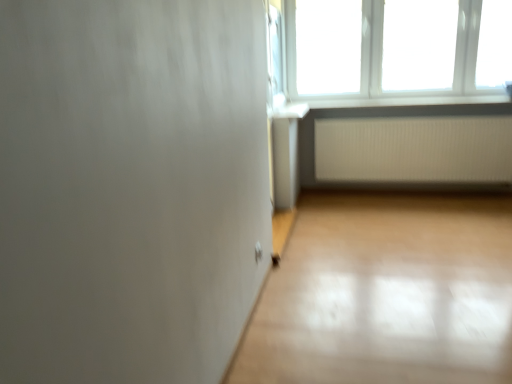
Question: Looking at their shapes, would you say white plastic window at upper right is wider or thinner than white plastic window sill at upper right?

Choices:
 (A) thin
 (B) wide

Answer: (A)

Question: From a real-world perspective, is white plastic window at upper right physically located above or below white plastic window sill at upper right?

Choices:
 (A) below
 (B) above

Answer: (B)

Question: Based on their relative distances, which object is nearer to the white ribbed radiator at lower right?

Choices:
 (A) white plastic window sill at upper right
 (B) white plastic window at upper right

Answer: (A)

Question: Which of these objects is positioned closest to the white plastic window sill at upper right?

Choices:
 (A) white plastic window at upper right
 (B) white ribbed radiator at lower right

Answer: (B)